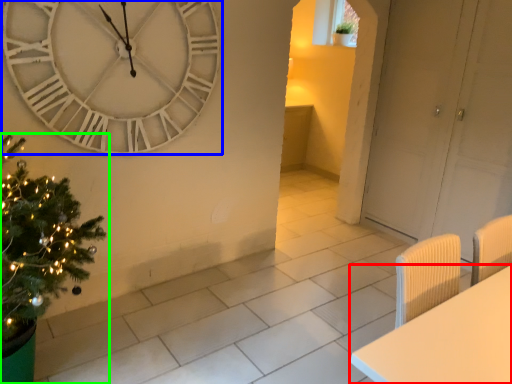
Question: Based on their relative distances, which object is farther from furniture (highlighted by a red box)? Choose from wall clock (highlighted by a blue box) and christmas tree (highlighted by a green box).

Choices:
 (A) wall clock
 (B) christmas tree

Answer: (A)